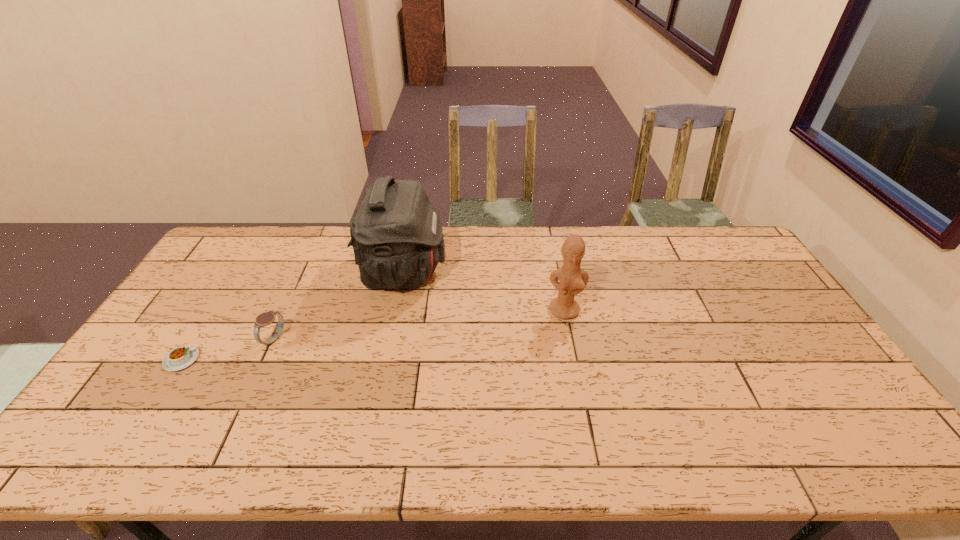
This screenshot has width=960, height=540. Find the location of `vacant region between the second tallest object and the shortest object`. vacant region between the second tallest object and the shortest object is located at coordinates (373, 335).

This screenshot has width=960, height=540. I want to click on vacant space in between the rightmost object and the leftmost object, so click(x=373, y=335).

Image resolution: width=960 pixels, height=540 pixels. I want to click on free area in between the leftmost object and the third object from left to right, so click(x=293, y=316).

Locate an element on the screen. Image resolution: width=960 pixels, height=540 pixels. free space between the figurine and the third tallest object is located at coordinates (420, 325).

Where is `free space that is in between the shoulder bag and the leftmost object`? free space that is in between the shoulder bag and the leftmost object is located at coordinates (293, 316).

What are the coordinates of `unoccupied position between the figurine and the tallest object` in the screenshot? It's located at (484, 291).

I want to click on free spot between the second object from right to left and the shortest object, so click(x=293, y=316).

This screenshot has height=540, width=960. I want to click on object that is the closest to the watch, so click(181, 357).

This screenshot has width=960, height=540. What are the coordinates of `object identified as the third closest to the tallest object` in the screenshot? It's located at (181, 357).

Where is `free spot that satisfies the following two spatial constraints: 1. on the open flap of the shoulder bag; 2. on the front side of the leftmost object`? The height and width of the screenshot is (540, 960). free spot that satisfies the following two spatial constraints: 1. on the open flap of the shoulder bag; 2. on the front side of the leftmost object is located at coordinates (386, 359).